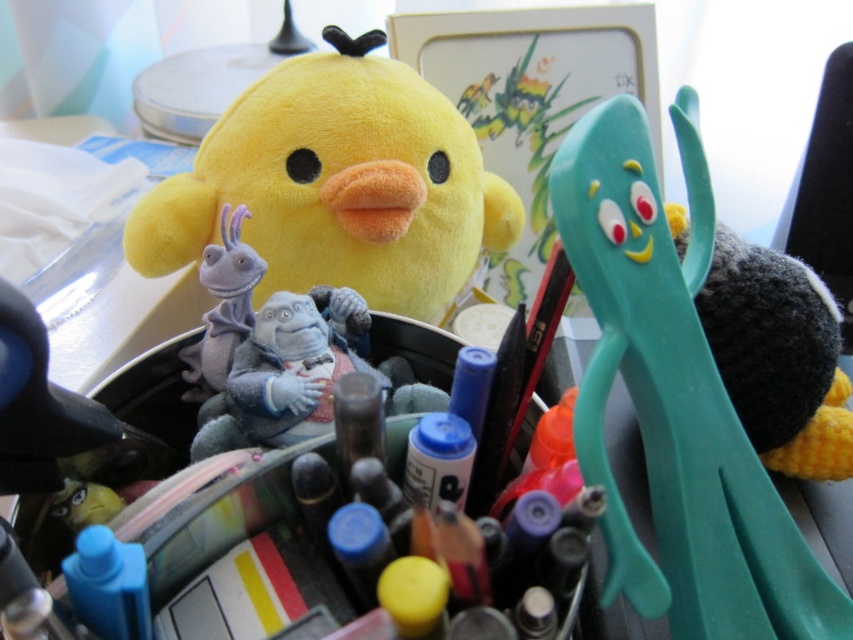
You are organizing a desk and need to place both the soft yellow plush at upper left and the fuzzy gray plush at center into a storage box. Which plush toy is taller and should be placed first to ensure they both fit?

The soft yellow plush at upper left is taller than the fuzzy gray plush at center, so it should be placed first in the storage box to accommodate its height.

You are organizing a desk and need to place a small decorative item between the soft yellow plush at upper left and the fuzzy gray plush at center. Which plush toy should you place the item closer to if you want it to be near the smaller one?

You should place the item closer to the fuzzy gray plush at center because it is smaller than the soft yellow plush at upper left.